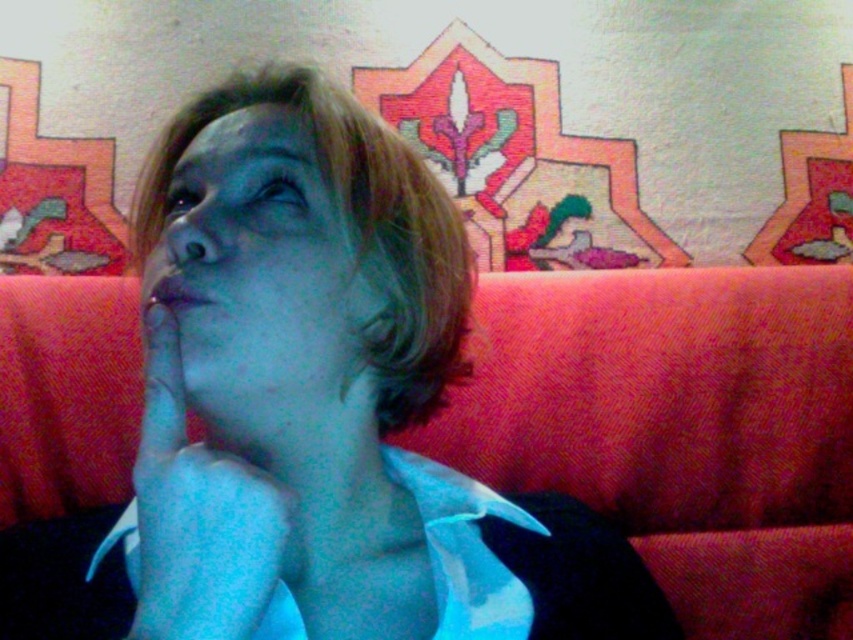
Question: Which is farther from the orange fabric couch at center?

Choices:
 (A) blue matte hand at center
 (B) blue matte face at center

Answer: (A)

Question: Is orange fabric couch at center above blue matte hand at center?

Choices:
 (A) yes
 (B) no

Answer: (B)

Question: Which of the following is the farthest from the observer?

Choices:
 (A) pyautogui.click(x=161, y=556)
 (B) pyautogui.click(x=817, y=625)

Answer: (B)

Question: Which object appears farthest from the camera in this image?

Choices:
 (A) blue matte hand at center
 (B) blue matte face at center
 (C) orange fabric couch at center

Answer: (C)

Question: Does orange fabric couch at center appear on the right side of blue matte face at center?

Choices:
 (A) yes
 (B) no

Answer: (A)

Question: Is orange fabric couch at center further to camera compared to blue matte face at center?

Choices:
 (A) no
 (B) yes

Answer: (B)